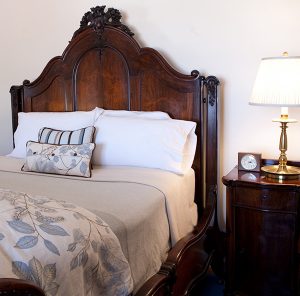
I want to click on shade, so click(281, 92).